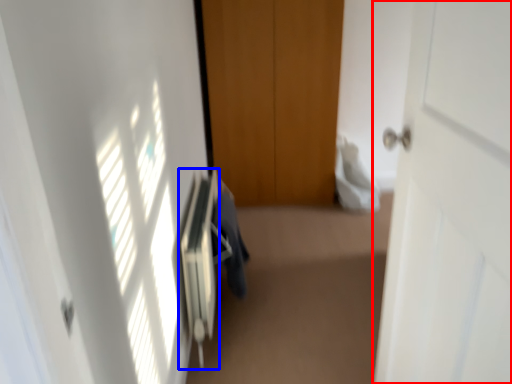
Question: Which point is further to the camera, door (highlighted by a red box) or radiator (highlighted by a blue box)?

Choices:
 (A) door
 (B) radiator

Answer: (B)